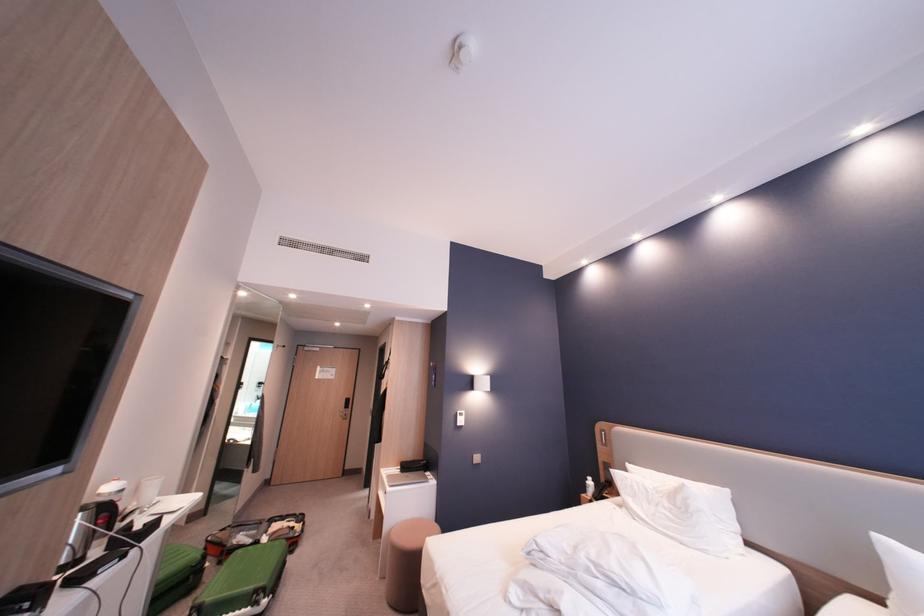
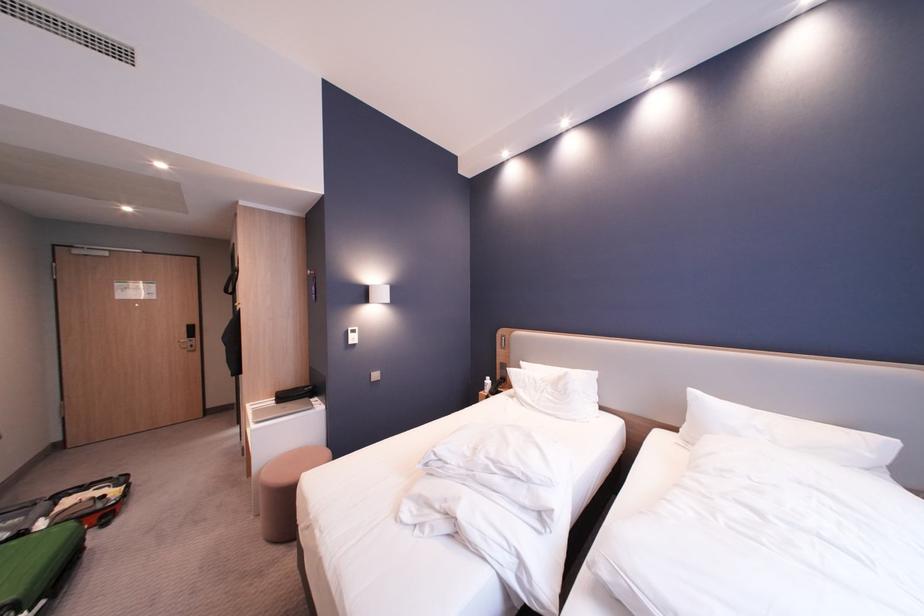
Where in the second image is the point corresponding to point (409, 471) from the first image?

(285, 403)